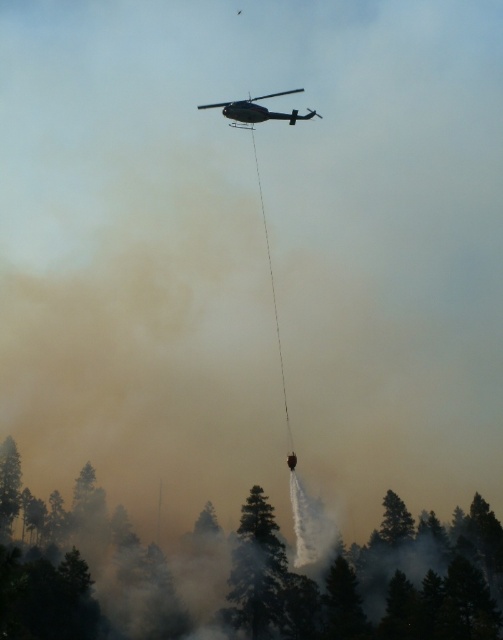
Question: Where is green matte tree at lower center located in relation to metallic silver helicopter at upper center in the image?

Choices:
 (A) left
 (B) right

Answer: (A)

Question: Which object appears closest to the camera in this image?

Choices:
 (A) green matte tree at center
 (B) metallic silver helicopter at upper center
 (C) green matte tree at lower center

Answer: (C)

Question: Does green matte tree at center have a greater width compared to metallic silver helicopter at upper center?

Choices:
 (A) yes
 (B) no

Answer: (B)

Question: Considering the real-world distances, which object is closest to the green matte tree at center?

Choices:
 (A) metallic silver helicopter at upper center
 (B) green matte tree at lower center

Answer: (B)

Question: Among these objects, which one is farthest from the camera?

Choices:
 (A) metallic silver helicopter at upper center
 (B) green matte tree at center

Answer: (B)

Question: Is green matte tree at center thinner than metallic silver helicopter at upper center?

Choices:
 (A) no
 (B) yes

Answer: (B)